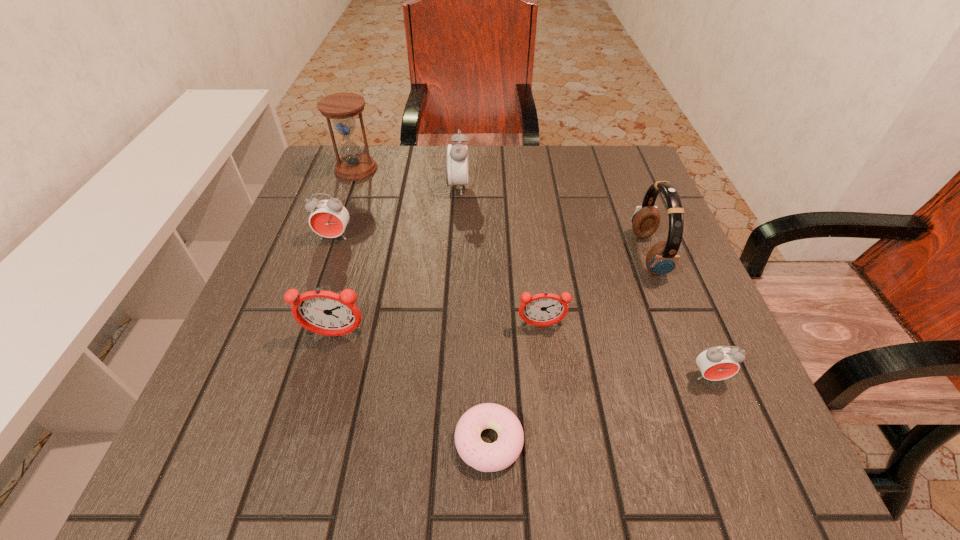
At what (x,y) coordinates should I click in order to perform the action: click on hourglass. Please return your answer as a coordinate pair (x, y). Looking at the image, I should click on (341, 107).

This screenshot has height=540, width=960. What are the coordinates of `headset` in the screenshot? It's located at (662, 258).

Locate an element on the screen. Image resolution: width=960 pixels, height=540 pixels. the third alarm clock from right to left is located at coordinates (456, 159).

Locate an element on the screen. the biggest red alarm clock is located at coordinates (456, 159).

You are a GUI agent. You are given a task and a screenshot of the screen. Output one action in this format:
    pyautogui.click(x=<x>, y=<y>)
    Task: Click on the left reddish-pink alarm clock
    This screenshot has height=540, width=960.
    Given the screenshot: What is the action you would take?
    pyautogui.click(x=327, y=313)

You are a GUI agent. You are given a task and a screenshot of the screen. Output one action in this format:
    pyautogui.click(x=<x>, y=<y>)
    Task: Click on the second smallest red alarm clock
    
    Given the screenshot: What is the action you would take?
    pyautogui.click(x=329, y=217)

The image size is (960, 540). In order to click on the leftmost red alarm clock in this screenshot , I will do `click(329, 217)`.

Locate an element on the screen. The image size is (960, 540). the right reddish-pink alarm clock is located at coordinates pyautogui.click(x=544, y=309).

The width and height of the screenshot is (960, 540). Identify the location of the fourth alarm clock from left to right. (544, 309).

At what (x,y) coordinates should I click in order to perform the action: click on the seventh farthest object. Please return your answer as a coordinate pair (x, y). Looking at the image, I should click on (716, 363).